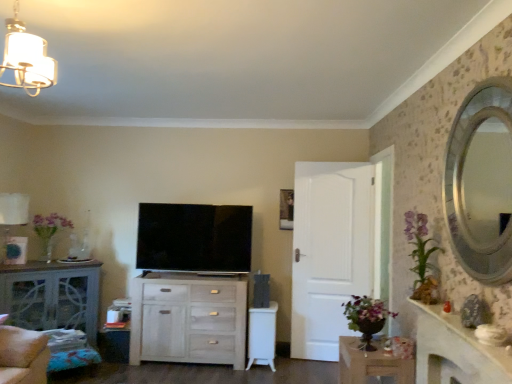
Identify the location of white glass chandelier at upper left, which is counted as the second lamp, starting from the bottom. 27,58.

The width and height of the screenshot is (512, 384). What do you see at coordinates (49, 231) in the screenshot?
I see `translucent glass vase at left, arranged as the 1th floral arrangement when viewed from the left` at bounding box center [49, 231].

Locate an element on the screen. matte gray cabinet at left, the first table when ordered from back to front is located at coordinates (52, 296).

Is matte gray cabinet at left, the 2th table positioned from the right, in contact with white textured cabinet at center?

No, matte gray cabinet at left, the 2th table positioned from the right, is not making contact with white textured cabinet at center.

Is matte gray cabinet at left, the 2th table positioned from the right, looking in the opposite direction of white textured cabinet at center?

No, matte gray cabinet at left, the 2th table positioned from the right, is not facing away from white textured cabinet at center.

Which object is thinner, matte gray cabinet at left, the first table when ordered from back to front, or white textured cabinet at center?

Thinner between the two is white textured cabinet at center.

From a real-world perspective, is matte gray cabinet at left, which ranks as the 1th table in left-to-right order, positioned over white textured cabinet at center based on gravity?

Yes, from a real-world perspective, matte gray cabinet at left, which ranks as the 1th table in left-to-right order, is above white textured cabinet at center.

From the picture: Is the depth of flat screen tv at center less than that of white marble fireplace at right?

No, it is not.

Does point (143, 262) come behind point (422, 332)?

Yes, point (143, 262) is behind point (422, 332).

Which is more to the right, flat screen tv at center or white marble fireplace at right?

Positioned to the right is white marble fireplace at right.

From the image's perspective, which object appears higher, white matte door at center or flat screen tv at center?

From the image's view, flat screen tv at center is above.

Is white matte door at center bigger than flat screen tv at center?

Yes.

Can you tell me how much white matte door at center and flat screen tv at center differ in facing direction?

white matte door at center and flat screen tv at center are facing 3.99 degrees away from each other.

Is white matte door at center thinner than flat screen tv at center?

Correct, the width of white matte door at center is less than that of flat screen tv at center.

Based on the photo, from the image's perspective, would you say purple matte floral arrangement at right, the first floral arrangement when ordered from front to back, is shown under flat screen tv at center?

No, from the image's perspective, purple matte floral arrangement at right, the first floral arrangement when ordered from front to back, is not beneath flat screen tv at center.

Considering the sizes of objects purple matte floral arrangement at right, the first floral arrangement when ordered from front to back, and flat screen tv at center in the image provided, who is wider, purple matte floral arrangement at right, the first floral arrangement when ordered from front to back, or flat screen tv at center?

purple matte floral arrangement at right, the first floral arrangement when ordered from front to back.

Could you tell me if purple matte floral arrangement at right, the 1th floral arrangement when ordered from right to left, is facing flat screen tv at center?

No, purple matte floral arrangement at right, the 1th floral arrangement when ordered from right to left, is not turned towards flat screen tv at center.

Is point (407, 213) positioned after point (179, 206)?

No, it is in front of (179, 206).

Are white glass chandelier at upper left, the second lamp when ordered from left to right, and translucent glass vase at left, which is the 2th floral arrangement from front to back, making contact?

white glass chandelier at upper left, the second lamp when ordered from left to right, and translucent glass vase at left, which is the 2th floral arrangement from front to back, are not in contact.

Does white glass chandelier at upper left, which appears as the first lamp when viewed from the front, contain translucent glass vase at left, which is the 2th floral arrangement from front to back?

No.

Is point (25, 30) closer or farther from the camera than point (45, 235)?

Point (25, 30).

Does white glass chandelier at upper left, marked as the 1th lamp in a right-to-left arrangement, have a smaller size compared to translucent glass vase at left, which is the 2th floral arrangement from front to back?

Yes, white glass chandelier at upper left, marked as the 1th lamp in a right-to-left arrangement, is smaller than translucent glass vase at left, which is the 2th floral arrangement from front to back.

From a real-world perspective, is matte gray cabinet at left, which ranks as the 1th table in left-to-right order, beneath white glass chandelier at upper left, marked as the 1th lamp in a right-to-left arrangement?

Yes, from a real-world perspective, matte gray cabinet at left, which ranks as the 1th table in left-to-right order, is beneath white glass chandelier at upper left, marked as the 1th lamp in a right-to-left arrangement.

Is matte gray cabinet at left, acting as the 2th table starting from the front, in front of or behind white glass chandelier at upper left, the 2th lamp viewed from the back, in the image?

matte gray cabinet at left, acting as the 2th table starting from the front, is behind white glass chandelier at upper left, the 2th lamp viewed from the back.

Is matte gray cabinet at left, which ranks as the 1th table in left-to-right order, facing towards white glass chandelier at upper left, marked as the 1th lamp in a right-to-left arrangement?

No, matte gray cabinet at left, which ranks as the 1th table in left-to-right order, is not oriented towards white glass chandelier at upper left, marked as the 1th lamp in a right-to-left arrangement.

I want to click on the 1st table below the white glass chandelier at upper left, the 2th lamp viewed from the back (from the image's perspective), so (52, 296).

From the image's perspective, relative to white matte door at center, is white marble fireplace at right above or below?

white marble fireplace at right is situated higher than white matte door at center in the image.

From a real-world perspective, does white marble fireplace at right stand above white matte door at center?

No, from a real-world perspective, white marble fireplace at right is not above white matte door at center.

Can you tell me how much white marble fireplace at right and white matte door at center differ in facing direction?

The angle between the facing direction of white marble fireplace at right and the facing direction of white matte door at center is 85.2 degrees.

Is there a large distance between white marble fireplace at right and white matte door at center?

white marble fireplace at right is far away from white matte door at center.

Find the location of a particular element. The image size is (512, 384). table on the left of white textured cabinet at center is located at coordinates (52, 296).

The height and width of the screenshot is (384, 512). Find the location of `counter top beneath the flat screen tv at center (from a real-world perspective)`. counter top beneath the flat screen tv at center (from a real-world perspective) is located at coordinates (455, 350).

When comparing their distances from wooden picture frame at center, does white marble fireplace at right or white textured cabinet at center seem further?

Among the two, white marble fireplace at right is located further to wooden picture frame at center.

When comparing their distances from translucent glass vase at left, the first floral arrangement in the back-to-front sequence, does flat screen tv at center or white matte door at center seem closer?

flat screen tv at center.

Estimate the real-world distances between objects in this image. Which object is further from white glass chandelier at upper left, the 1th lamp viewed from the top, flat screen tv at center or purple matte floral arrangement at right, the first floral arrangement when ordered from front to back?

purple matte floral arrangement at right, the first floral arrangement when ordered from front to back, is positioned further to the anchor white glass chandelier at upper left, the 1th lamp viewed from the top.

Looking at the image, which one is located further to purple matte floral arrangement at right, which is counted as the second floral arrangement, starting from the left, flat screen tv at center or white fabric lampshade at left, the second lamp when ordered from front to back?

white fabric lampshade at left, the second lamp when ordered from front to back, is positioned further to the anchor purple matte floral arrangement at right, which is counted as the second floral arrangement, starting from the left.

Looking at the image, which one is located further to white textured cabinet at center, white marble fireplace at right or translucent glass vase at left, which is the 2th floral arrangement from front to back?

white marble fireplace at right lies further to white textured cabinet at center than the other object.

Based on their spatial positions, is white textured cabinet at center or white marble fireplace at right closer to wooden table at lower right, marked as the first table in a right-to-left arrangement?

white marble fireplace at right is closer to wooden table at lower right, marked as the first table in a right-to-left arrangement.

When comparing their distances from matte gray cabinet at left, the 2th table positioned from the right, does translucent glass vase at left, the 2th floral arrangement positioned from the right, or flat screen tv at center seem further?

The object further to matte gray cabinet at left, the 2th table positioned from the right, is flat screen tv at center.

Considering their positions, is purple matte floral arrangement at right, the 1th floral arrangement when ordered from right to left, positioned further to wooden table at lower right, which is the 2th table from left to right, than wooden picture frame at center?

wooden picture frame at center lies further to wooden table at lower right, which is the 2th table from left to right, than the other object.

Where is `floral arrangement located between white fabric lampshade at left, the 1th lamp from the back, and wooden picture frame at center in the left-right direction`? Image resolution: width=512 pixels, height=384 pixels. floral arrangement located between white fabric lampshade at left, the 1th lamp from the back, and wooden picture frame at center in the left-right direction is located at coordinates (49, 231).

The height and width of the screenshot is (384, 512). Find the location of `television between white marble fireplace at right and white matte door at center from front to back`. television between white marble fireplace at right and white matte door at center from front to back is located at coordinates (194, 238).

This screenshot has height=384, width=512. I want to click on chest of drawers between white fabric lampshade at left, the 1th lamp from the back, and wooden table at lower right, which is the 2th table from left to right, from left to right, so click(x=189, y=319).

Find the location of a particular element. The image size is (512, 384). television located between translucent glass vase at left, the first floral arrangement in the back-to-front sequence, and purple matte floral arrangement at right, which is counted as the second floral arrangement, starting from the left, in the left-right direction is located at coordinates (194, 238).